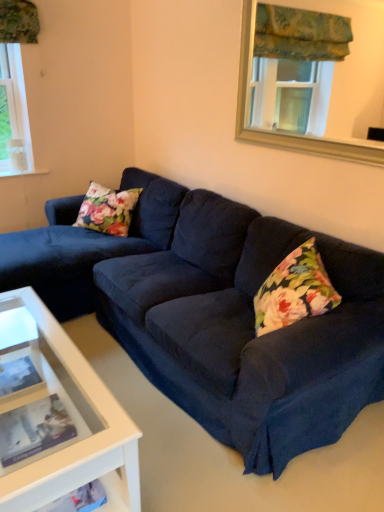
Question: Considering the positions of gold-framed mirror at upper center and suede dark blue couch at center in the image, is gold-framed mirror at upper center wider or thinner than suede dark blue couch at center?

Choices:
 (A) wide
 (B) thin

Answer: (B)

Question: From the image's perspective, relative to suede dark blue couch at center, is gold-framed mirror at upper center above or below?

Choices:
 (A) above
 (B) below

Answer: (A)

Question: Based on their sizes in the image, would you say gold-framed mirror at upper center is bigger or smaller than suede dark blue couch at center?

Choices:
 (A) small
 (B) big

Answer: (A)

Question: Based on their sizes in the image, would you say suede dark blue couch at center is bigger or smaller than gold-framed mirror at upper center?

Choices:
 (A) big
 (B) small

Answer: (A)

Question: Considering the positions of point (297, 445) and point (248, 96), is point (297, 445) closer or farther from the camera than point (248, 96)?

Choices:
 (A) closer
 (B) farther

Answer: (A)

Question: Considering the positions of suede dark blue couch at center and gold-framed mirror at upper center in the image, is suede dark blue couch at center taller or shorter than gold-framed mirror at upper center?

Choices:
 (A) tall
 (B) short

Answer: (A)

Question: Considering the positions of suede dark blue couch at center and gold-framed mirror at upper center in the image, is suede dark blue couch at center wider or thinner than gold-framed mirror at upper center?

Choices:
 (A) thin
 (B) wide

Answer: (B)